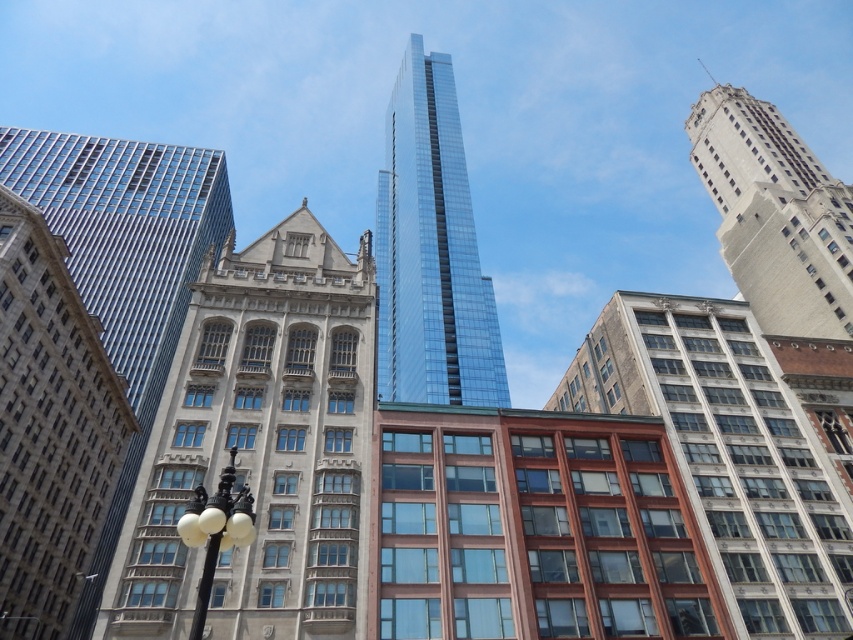
Is stone textured building at center bigger than black glass lamp post at lower left?

Yes, stone textured building at center is bigger than black glass lamp post at lower left.

Where is `stone textured building at center`? The height and width of the screenshot is (640, 853). stone textured building at center is located at coordinates (260, 445).

I want to click on stone textured building at center, so click(260, 445).

Between glassy steel skyscraper at left and black glass lamp post at lower left, which one appears on the right side from the viewer's perspective?

black glass lamp post at lower left

Is point (173, 209) more distant than point (198, 531)?

That is True.

Is point (115, 273) farther from camera compared to point (230, 483)?

Yes, point (115, 273) is behind point (230, 483).

In order to click on glassy steel skyscraper at left in this screenshot , I will do `click(125, 262)`.

Is stone textured building at center to the left of brown brick building at center from the viewer's perspective?

Correct, you'll find stone textured building at center to the left of brown brick building at center.

Is stone textured building at center below brown brick building at center?

Actually, stone textured building at center is above brown brick building at center.

Does point (340, 419) come farther from viewer compared to point (839, 509)?

No, it is not.

This screenshot has width=853, height=640. What are the coordinates of `stone textured building at center` in the screenshot? It's located at (260, 445).